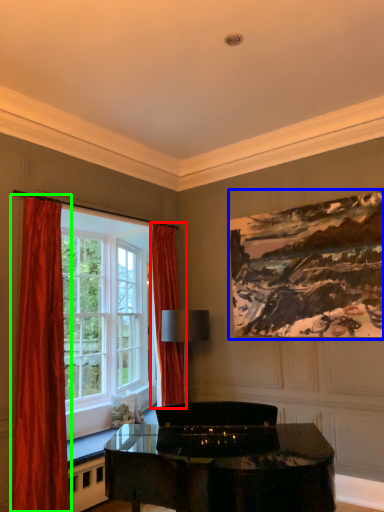
Question: Which object is positioned closest to curtain (highlighted by a red box)? Select from picture frame (highlighted by a blue box) and curtain (highlighted by a green box).

Choices:
 (A) picture frame
 (B) curtain

Answer: (A)